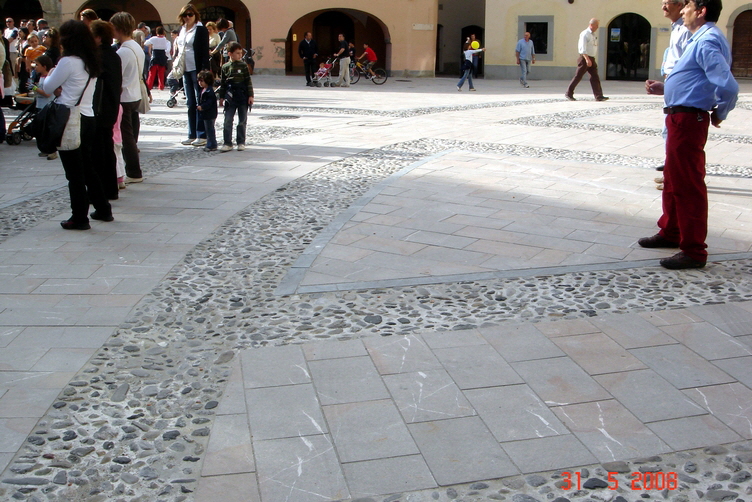
Image resolution: width=752 pixels, height=502 pixels. Identify the location of arch doorway. (628, 15).